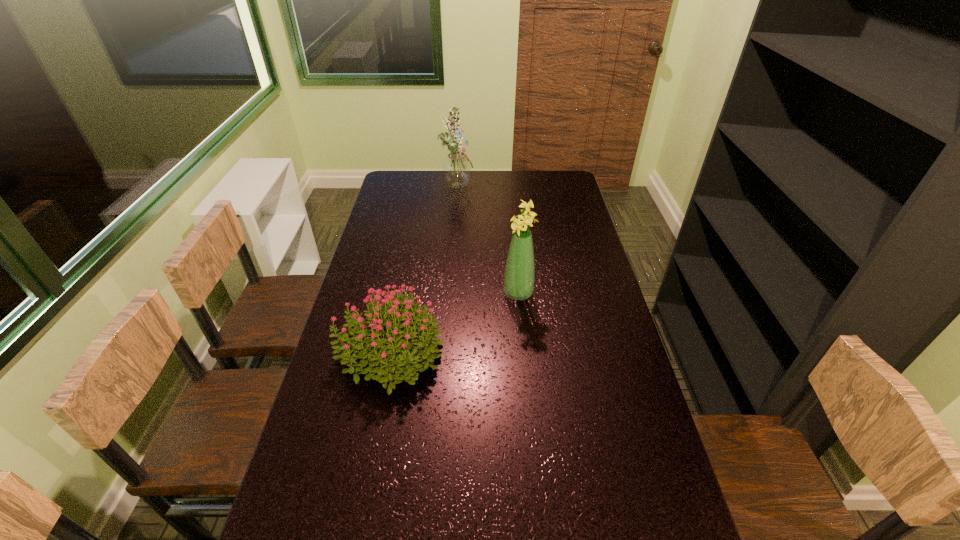
Choose which bouquet is the second nearest neighbor to the farthest bouquet. Please provide its 2D coordinates. Your answer should be formatted as a tuple, i.e. [(x, y)], where the tuple contains the x and y coordinates of a point satisfying the conditions above.

[(383, 356)]

What are the coordinates of `bouquet that is the closest to the farthest object` in the screenshot? It's located at (519, 276).